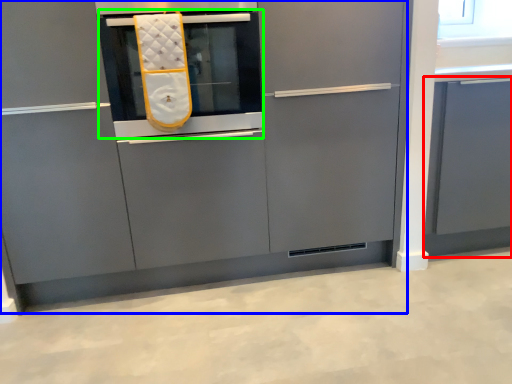
Question: Based on their relative distances, which object is nearer to cabinetry (highlighted by a red box)? Choose from cabinetry (highlighted by a blue box) and oven (highlighted by a green box).

Choices:
 (A) cabinetry
 (B) oven

Answer: (A)